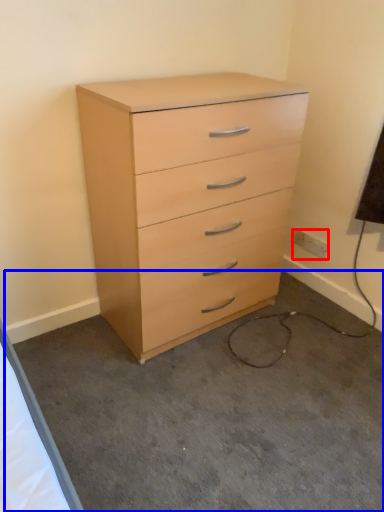
Question: Which point is further to the camera, electric outlet (highlighted by a red box) or concrete (highlighted by a blue box)?

Choices:
 (A) electric outlet
 (B) concrete

Answer: (A)